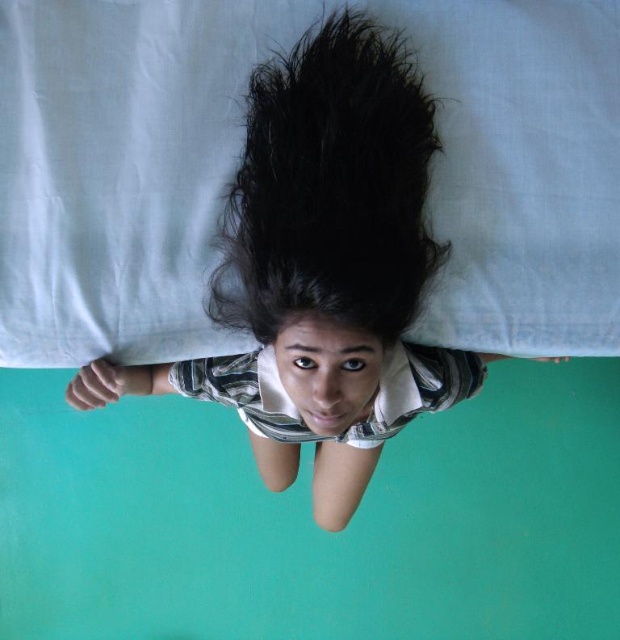
Question: Among these points, which one is nearest to the camera?

Choices:
 (A) (x=356, y=115)
 (B) (x=246, y=289)

Answer: (A)

Question: Observing the image, what is the correct spatial positioning of smooth black hair at center in reference to black matte hair at center?

Choices:
 (A) left
 (B) right

Answer: (A)

Question: Does smooth black hair at center have a greater width compared to black matte hair at center?

Choices:
 (A) no
 (B) yes

Answer: (B)

Question: Does smooth black hair at center come in front of black matte hair at center?

Choices:
 (A) no
 (B) yes

Answer: (A)